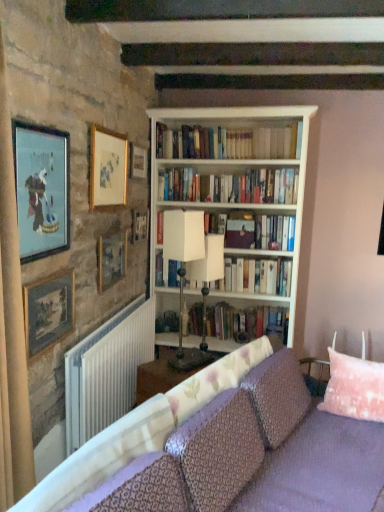
Where is `free space above white paperbacks at center, which appears as the second book when viewed from the top (from a real-world perspective)`? The width and height of the screenshot is (384, 512). free space above white paperbacks at center, which appears as the second book when viewed from the top (from a real-world perspective) is located at coordinates (221, 167).